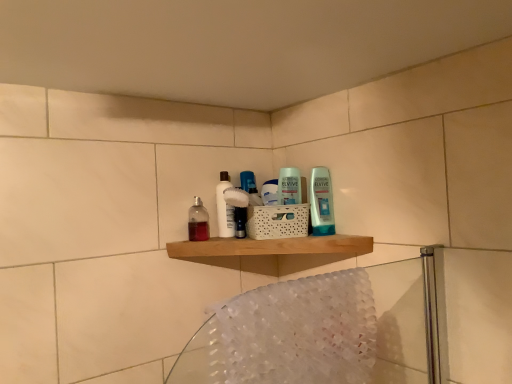
Question: In terms of size, does wooden shelf at center appear bigger or smaller than translucent plastic bottle at center?

Choices:
 (A) small
 (B) big

Answer: (B)

Question: Choose the correct answer: Is wooden shelf at center inside translucent plastic bottle at center or outside it?

Choices:
 (A) outside
 (B) inside

Answer: (A)

Question: Estimate the real-world distances between objects in this image. Which object is closer to the translucent plastic bottle at center?

Choices:
 (A) translucent fabric bath towel at lower right
 (B) white glossy bottle at center
 (C) wooden shelf at center

Answer: (B)

Question: Which object is the farthest from the translucent fabric bath towel at lower right?

Choices:
 (A) white glossy bottle at center
 (B) translucent plastic bottle at center
 (C) wooden shelf at center

Answer: (B)